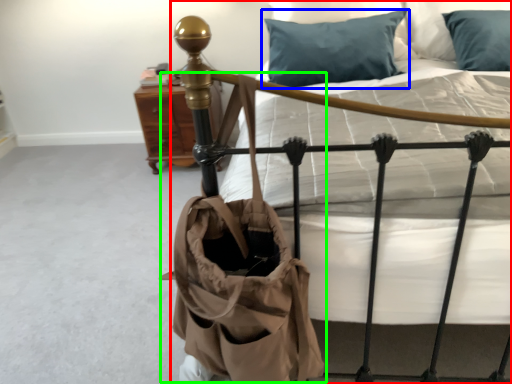
Question: Based on their relative distances, which object is farther from bed (highlighted by a red box)? Choose from pillow (highlighted by a blue box) and shoulder bag (highlighted by a green box).

Choices:
 (A) pillow
 (B) shoulder bag

Answer: (A)